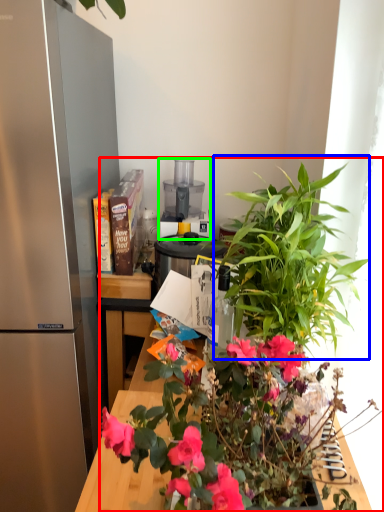
Question: Which object is positioned farthest from houseplant (highlighted by a red box)? Select from vegetation (highlighted by a blue box) and appliance (highlighted by a green box).

Choices:
 (A) vegetation
 (B) appliance

Answer: (B)